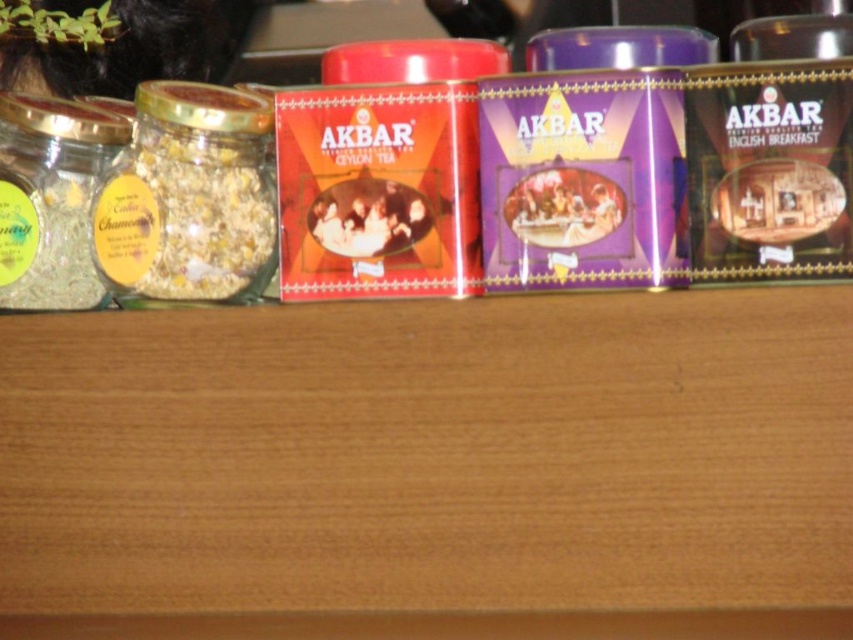
Question: Is translucent glass jar at left to the left of clear glass jar at left from the viewer's perspective?

Choices:
 (A) yes
 (B) no

Answer: (B)

Question: Is translucent glass jar at left positioned at the back of clear glass jar at left?

Choices:
 (A) no
 (B) yes

Answer: (A)

Question: Is translucent glass jar at left wider than clear glass jar at left?

Choices:
 (A) no
 (B) yes

Answer: (B)

Question: Which object appears closest to the camera in this image?

Choices:
 (A) clear glass jar at left
 (B) translucent glass jar at left

Answer: (B)